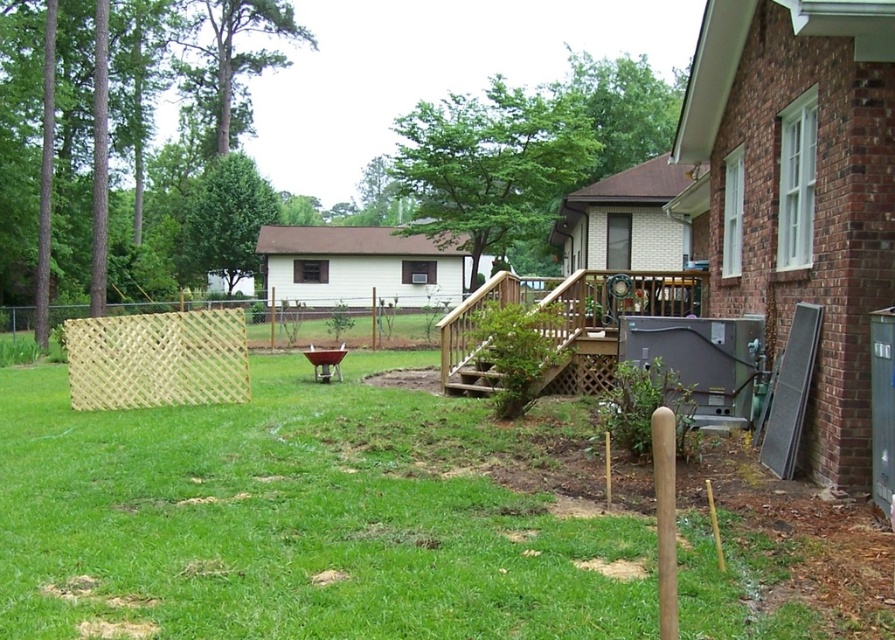
You are a painter planning to paint the light brown lattice fence at lower left and the brown wooden porch at center. You need to know which one requires a taller ladder to reach its top. Based on the scene, which one needs a taller ladder?

The light brown lattice fence at lower left has a greater height compared to the brown wooden porch at center, so it requires a taller ladder to reach its top.